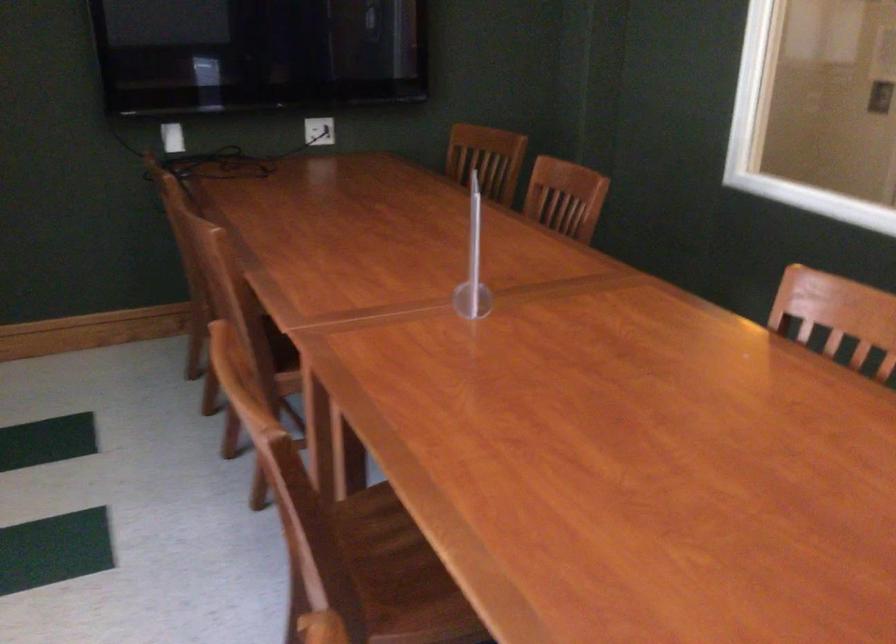
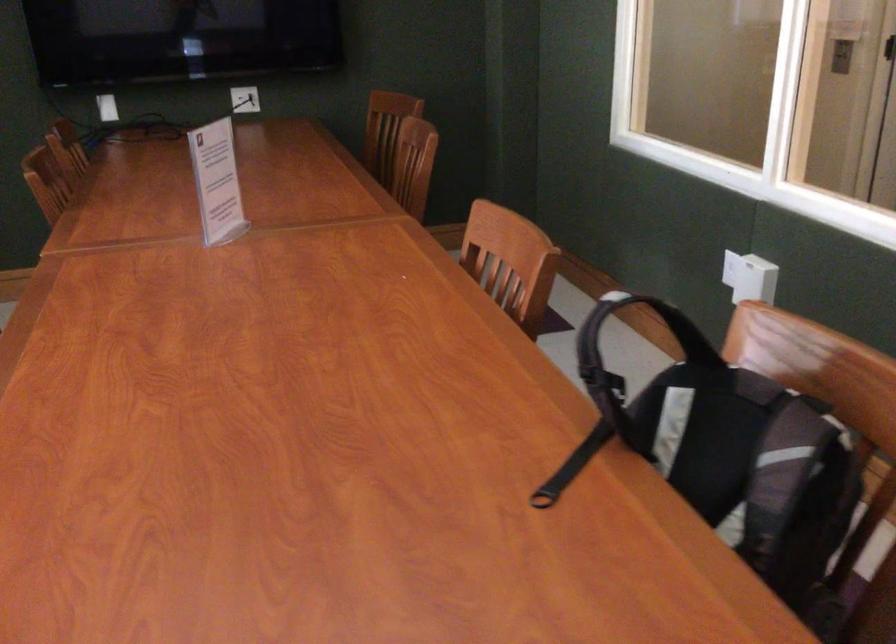
Question: What movement of the cameraman would produce the second image?

Choices:
 (A) Left
 (B) Right
 (C) Forward
 (D) Backward

Answer: (B)